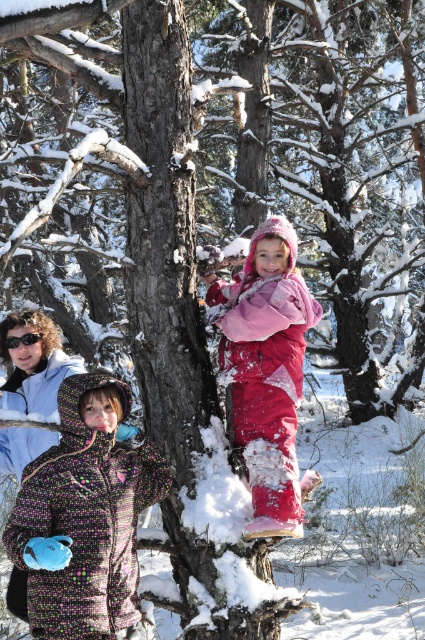
Is point (31, 532) positioned in front of point (263, 472)?

Yes.

Who is lower down, multicolored fleece jacket at lower left or fluffy pink snowsuit at center?

multicolored fleece jacket at lower left is lower down.

Which is behind, point (88, 428) or point (288, 269)?

Point (288, 269)

Where is `multicolored fleece jacket at lower left`? The image size is (425, 640). multicolored fleece jacket at lower left is located at coordinates (85, 513).

Between multicolored fleece jacket at lower left and black plastic goggles at upper left, which one is positioned lower?

multicolored fleece jacket at lower left

Can you confirm if multicolored fleece jacket at lower left is thinner than black plastic goggles at upper left?

No, multicolored fleece jacket at lower left is not thinner than black plastic goggles at upper left.

What do you see at coordinates (85, 513) in the screenshot?
I see `multicolored fleece jacket at lower left` at bounding box center [85, 513].

Where is `multicolored fleece jacket at lower left`? The image size is (425, 640). multicolored fleece jacket at lower left is located at coordinates (85, 513).

Between fluffy pink snowsuit at center and black plastic goggles at upper left, which one is positioned lower?

fluffy pink snowsuit at center is lower down.

Is fluffy pink snowsuit at center taller than black plastic goggles at upper left?

Indeed, fluffy pink snowsuit at center has a greater height compared to black plastic goggles at upper left.

Between point (241, 294) and point (31, 337), which one is positioned behind?

Positioned behind is point (31, 337).

You are a GUI agent. You are given a task and a screenshot of the screen. Output one action in this format:
    pyautogui.click(x=<x>, y=<y>)
    Task: Click on the fluffy pink snowsuit at center
    The image size is (425, 640).
    Given the screenshot: What is the action you would take?
    pyautogui.click(x=266, y=371)